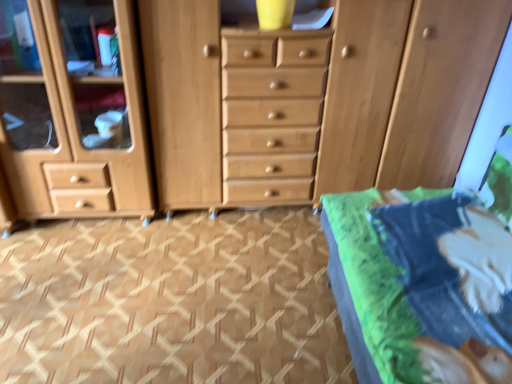
Where is `vacant area on top of brown textured carpet at center (from a real-world perspective)`? vacant area on top of brown textured carpet at center (from a real-world perspective) is located at coordinates (174, 278).